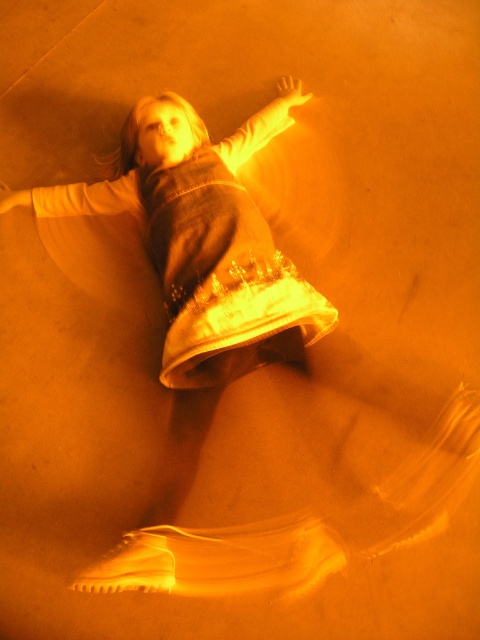
Which of these two, matte yellow sleeve at upper left or matte white arm at upper center, stands shorter?

matte yellow sleeve at upper left

This screenshot has height=640, width=480. Find the location of `matte yellow sleeve at upper left`. matte yellow sleeve at upper left is located at coordinates (76, 196).

In order to click on white satin dress at center in this screenshot , I will do `click(223, 276)`.

Does white satin dress at center appear on the left side of matte white arm at upper center?

Yes, white satin dress at center is to the left of matte white arm at upper center.

Does point (237, 253) come closer to viewer compared to point (263, 115)?

That is True.

Image resolution: width=480 pixels, height=640 pixels. In order to click on white satin dress at center in this screenshot , I will do `click(223, 276)`.

Does white satin dress at center have a smaller size compared to matte yellow sleeve at upper left?

Actually, white satin dress at center might be larger than matte yellow sleeve at upper left.

Does point (292, 285) lie in front of point (57, 205)?

Yes.

The width and height of the screenshot is (480, 640). Identify the location of white satin dress at center. (223, 276).

What are the coordinates of `white satin dress at center` in the screenshot? It's located at (223, 276).